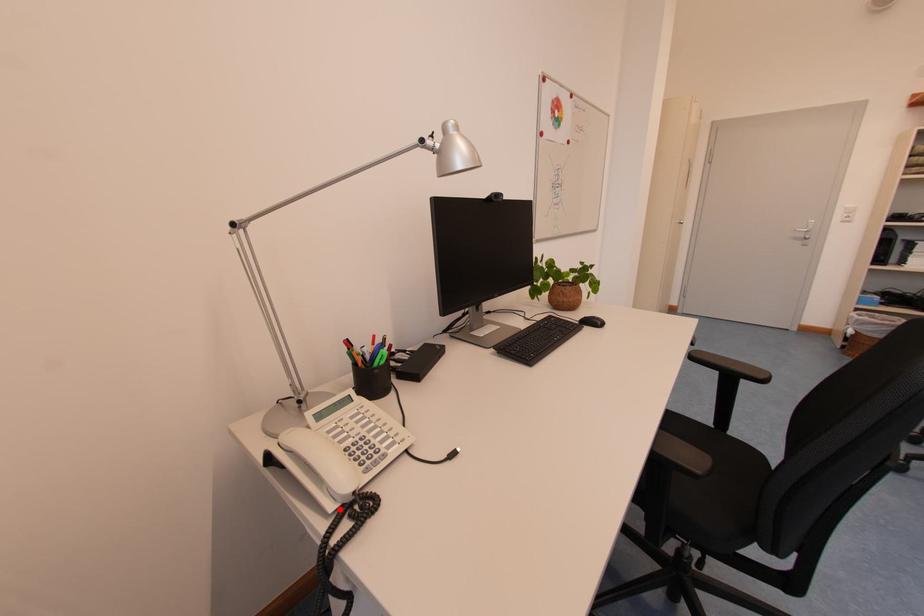
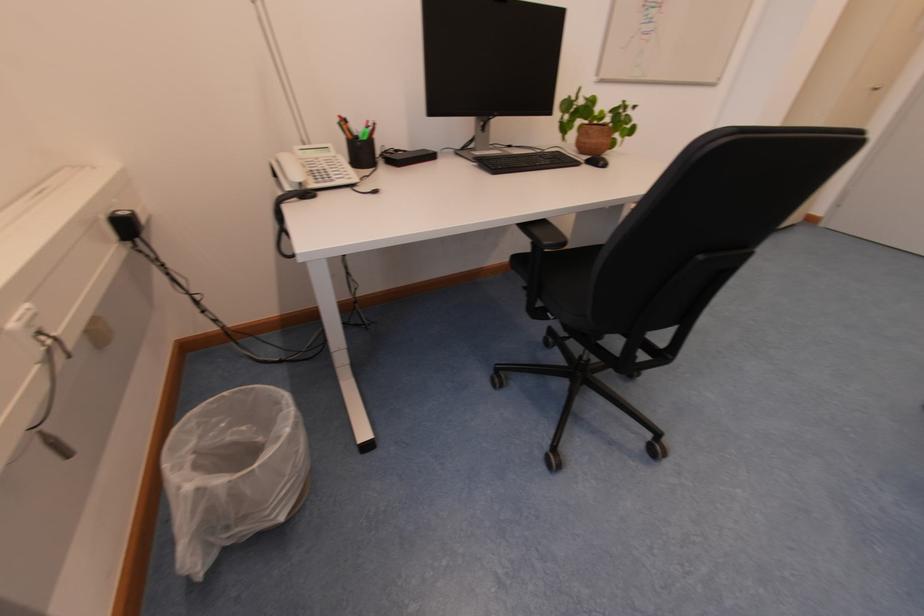
Where in the second image is the point corresponding to the highlighted location from the first image?

(296, 191)